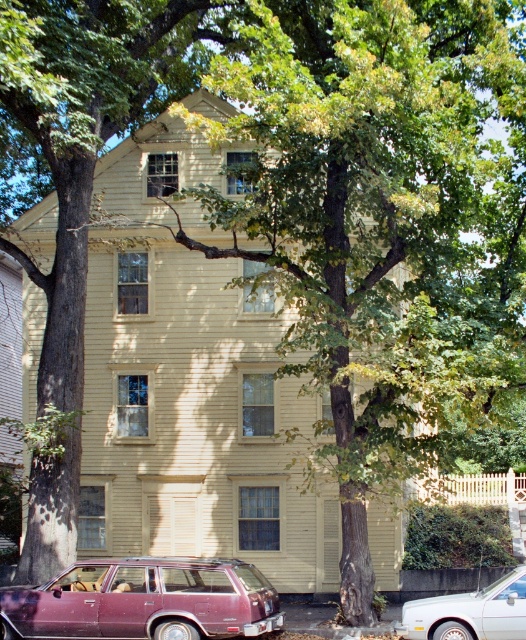
Question: Considering the relative positions of maroon metallic station wagon at lower left and white glossy sedan at lower right in the image provided, where is maroon metallic station wagon at lower left located with respect to white glossy sedan at lower right?

Choices:
 (A) right
 (B) left

Answer: (B)

Question: In this image, where is maroon metallic station wagon at lower left located relative to white glossy sedan at lower right?

Choices:
 (A) above
 (B) below

Answer: (B)

Question: Does maroon metallic station wagon at lower left lie in front of white glossy sedan at lower right?

Choices:
 (A) yes
 (B) no

Answer: (B)